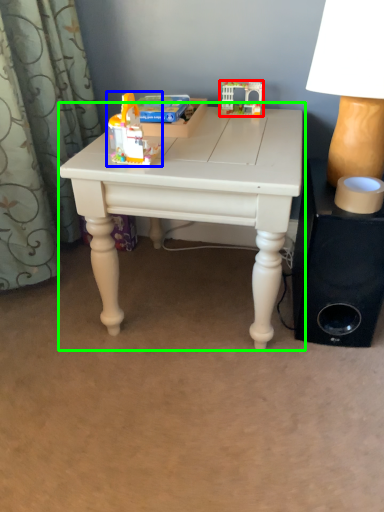
Question: Based on their relative distances, which object is nearer to toy (highlighted by a red box)? Choose from toy (highlighted by a blue box) and table (highlighted by a green box).

Choices:
 (A) toy
 (B) table

Answer: (B)